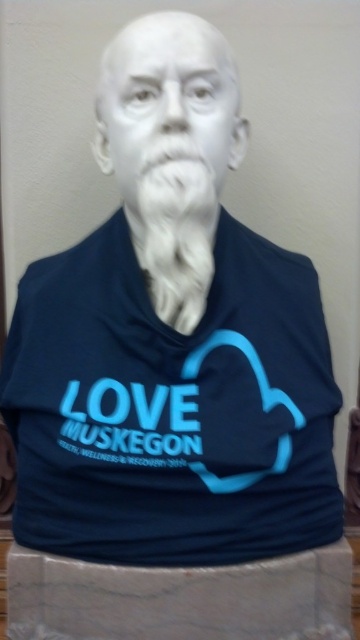
Measure the distance between point [23,525] and camera.

Point [23,525] is 1.44 meters away from camera.

Is matte blue jersey at center wider than white fluffy beard at center?

Yes, matte blue jersey at center is wider than white fluffy beard at center.

Is point (38, 540) positioned before point (191, 163)?

No, it is behind (191, 163).

In order to click on matte blue jersey at center in this screenshot , I will do `click(171, 408)`.

From the picture: Between matte blue jersey at center and white marble bust at center, which one is positioned lower?

matte blue jersey at center

Is matte blue jersey at center wider than white marble bust at center?

Yes.

Does point (73, 310) come in front of point (111, 132)?

No.

At what (x,y) coordinates should I click in order to perform the action: click on matte blue jersey at center. Please return your answer as a coordinate pair (x, y). The width and height of the screenshot is (360, 640). Looking at the image, I should click on (171, 408).

Is point (102, 131) positioned before point (145, 266)?

No.

Is white marble bust at center wider than white fluffy beard at center?

Correct, the width of white marble bust at center exceeds that of white fluffy beard at center.

Locate an element on the screen. This screenshot has height=640, width=360. white marble bust at center is located at coordinates (167, 100).